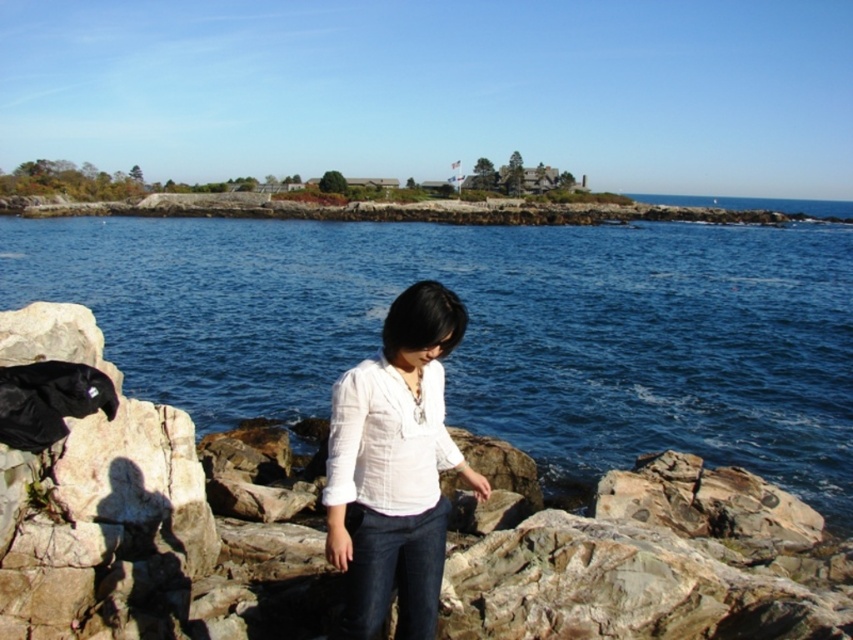
Is blue liquid water at center positioned in front of white cotton blouse at center?

That is False.

Is point (712, 323) closer to camera compared to point (351, 467)?

No, (712, 323) is further to viewer.

Find the location of a particular element. The height and width of the screenshot is (640, 853). blue liquid water at center is located at coordinates (488, 330).